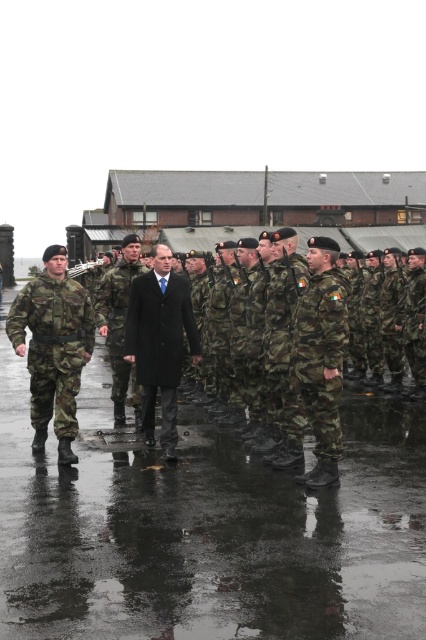
Does point (336, 272) come behind point (100, 314)?

No.

Who is more forward, (317,396) or (101,308)?

Positioned in front is point (317,396).

Identify the location of camouflage fabric uniform at center. (321, 356).

Is camouflage fabric uniform at left to the right of dark wool coat at center from the viewer's perspective?

Incorrect, camouflage fabric uniform at left is not on the right side of dark wool coat at center.

Does camouflage fabric uniform at left have a smaller size compared to dark wool coat at center?

Correct, camouflage fabric uniform at left occupies less space than dark wool coat at center.

Identify the location of camouflage fabric uniform at left. Image resolution: width=426 pixels, height=640 pixels. (52, 346).

Between wet asphalt at center and camouflage fabric uniform at center, which one is positioned lower?

wet asphalt at center

What do you see at coordinates (207, 531) in the screenshot?
I see `wet asphalt at center` at bounding box center [207, 531].

Identify the location of wet asphalt at center. (207, 531).